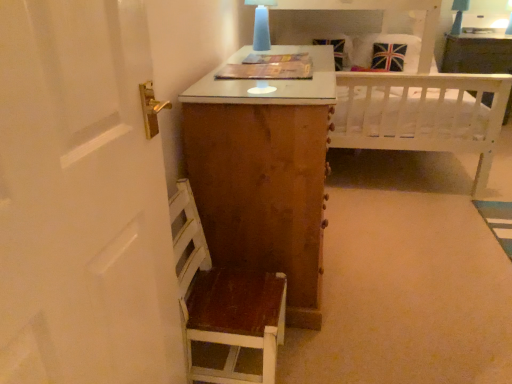
Question: Is matte blue glass at upper center positioned in front of wooden chair at lower left?

Choices:
 (A) no
 (B) yes

Answer: (A)

Question: From a real-world perspective, does matte blue glass at upper center sit lower than wooden chair at lower left?

Choices:
 (A) no
 (B) yes

Answer: (A)

Question: From a real-world perspective, is matte blue glass at upper center positioned over wooden chair at lower left based on gravity?

Choices:
 (A) no
 (B) yes

Answer: (B)

Question: Does matte blue glass at upper center have a lesser height compared to wooden chair at lower left?

Choices:
 (A) yes
 (B) no

Answer: (A)

Question: Is matte blue glass at upper center at the right side of wooden chair at lower left?

Choices:
 (A) no
 (B) yes

Answer: (B)

Question: From the image's perspective, is wooden chair at lower left above or below matte blue glass at upper center?

Choices:
 (A) below
 (B) above

Answer: (A)

Question: Is wooden chair at lower left inside or outside of matte blue glass at upper center?

Choices:
 (A) inside
 (B) outside

Answer: (B)

Question: Relative to matte blue glass at upper center, is wooden chair at lower left in front or behind?

Choices:
 (A) front
 (B) behind

Answer: (A)

Question: From a real-world perspective, is wooden chair at lower left above or below matte blue glass at upper center?

Choices:
 (A) above
 (B) below

Answer: (B)

Question: From the image's perspective, is white wooden bed at upper center positioned above or below wooden chair at lower left?

Choices:
 (A) below
 (B) above

Answer: (B)

Question: Considering the positions of white wooden bed at upper center and wooden chair at lower left in the image, is white wooden bed at upper center wider or thinner than wooden chair at lower left?

Choices:
 (A) wide
 (B) thin

Answer: (A)

Question: From a real-world perspective, is white wooden bed at upper center physically located above or below wooden chair at lower left?

Choices:
 (A) below
 (B) above

Answer: (B)

Question: Which is correct: white wooden bed at upper center is inside wooden chair at lower left, or outside of it?

Choices:
 (A) inside
 (B) outside

Answer: (B)

Question: From a real-world perspective, is white wood vanity at upper right positioned above or below union jack fabric pillow at upper right?

Choices:
 (A) below
 (B) above

Answer: (A)

Question: Looking at the image, does white wood vanity at upper right seem bigger or smaller compared to union jack fabric pillow at upper right?

Choices:
 (A) small
 (B) big

Answer: (B)